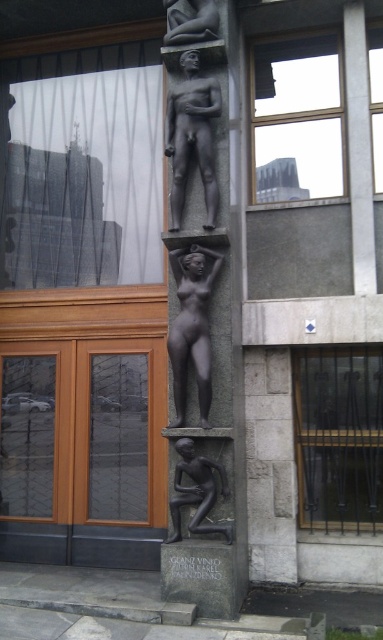
You are an art curator planning to install a new sculpture in a gallery. The space allocated for the sculpture must accommodate both the bronze statue at center and the matte bronze statue at upper center. Given their widths, which statue requires a wider space for proper display?

The matte bronze statue at upper center requires a wider space because its width is greater than the bronze statue at center.

Based on the scene description, which statue is positioned higher up on the sculpture? The bronze statue at center or the matte bronze statue at upper center?

The matte bronze statue at upper center is positioned higher up because it is located above the bronze statue at center.